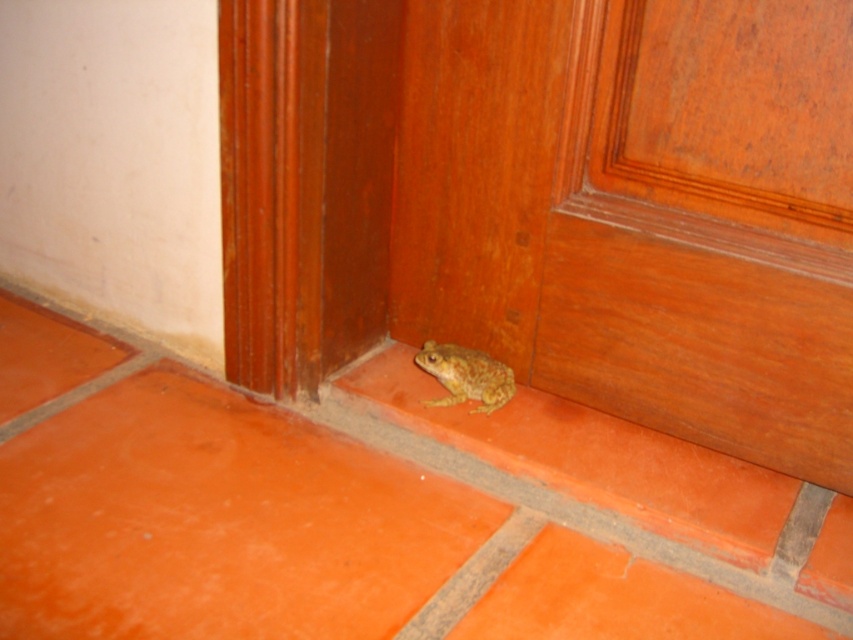
Does wooden door at lower right appear on the left side of camouflage skin frog at lower right?

No, wooden door at lower right is not to the left of camouflage skin frog at lower right.

Is wooden door at lower right behind camouflage skin frog at lower right?

No, wooden door at lower right is in front of camouflage skin frog at lower right.

Which is in front, point (762, 22) or point (460, 355)?

Point (762, 22) is in front.

This screenshot has height=640, width=853. What are the coordinates of `wooden door at lower right` in the screenshot? It's located at tap(554, 204).